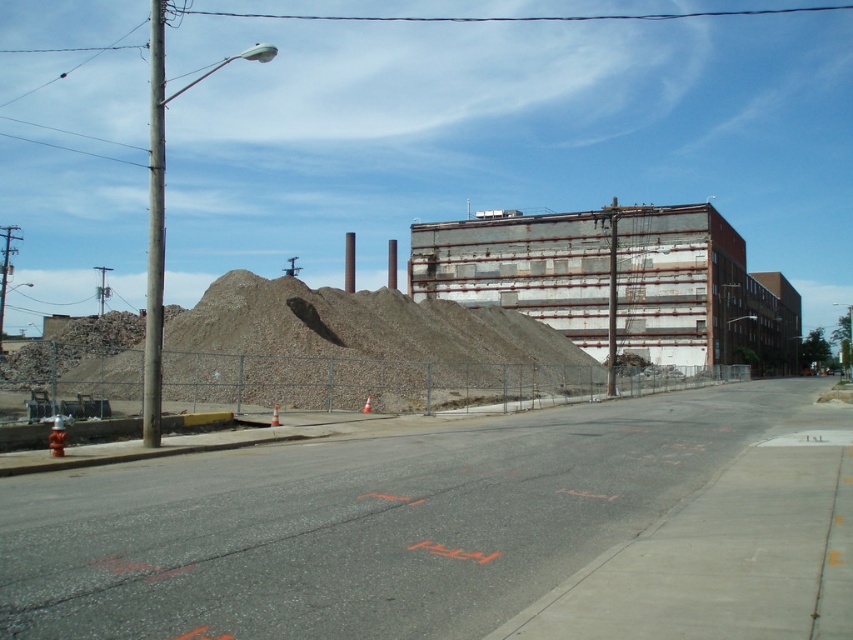
Locate an element on the screen. gray gravel pile at center is located at coordinates (380, 518).

Between gray gravel pile at center and rusty metal building at center, which one is positioned lower?

gray gravel pile at center is below.

I want to click on gray gravel pile at center, so click(x=380, y=518).

What are the coordinates of `gray gravel pile at center` in the screenshot? It's located at (380, 518).